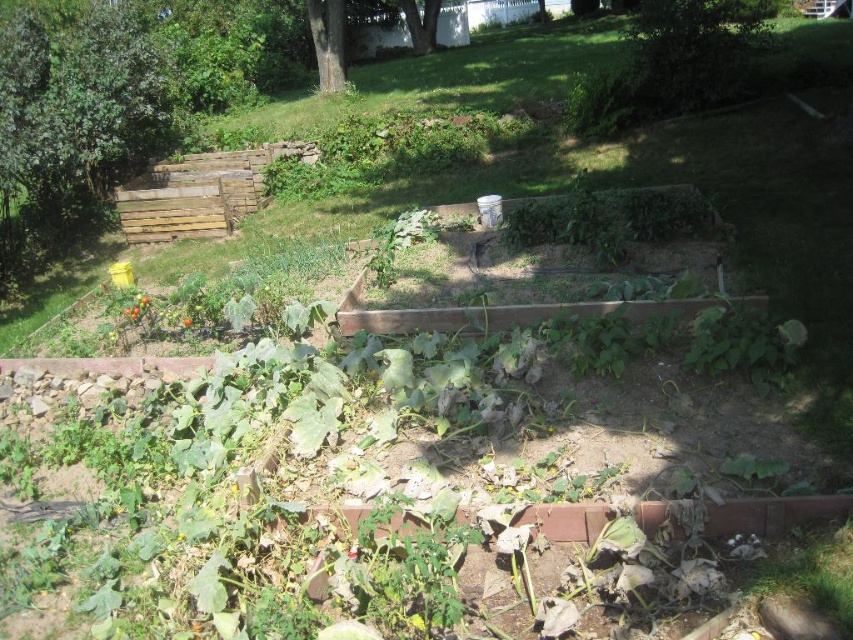
Question: Can you confirm if green rough bark tree at upper center is positioned below green leafy tree at upper center?

Choices:
 (A) no
 (B) yes

Answer: (B)

Question: Does green rough bark tree at upper center have a lesser width compared to green leafy tree at upper center?

Choices:
 (A) yes
 (B) no

Answer: (A)

Question: Which of the following is the farthest from the observer?

Choices:
 (A) green rough bark tree at upper center
 (B) green leafy tree at upper center

Answer: (B)

Question: Can you confirm if green rough bark tree at upper center is thinner than green leafy tree at upper center?

Choices:
 (A) yes
 (B) no

Answer: (A)

Question: Which point is farther from the camera taking this photo?

Choices:
 (A) pyautogui.click(x=421, y=42)
 (B) pyautogui.click(x=338, y=38)

Answer: (A)